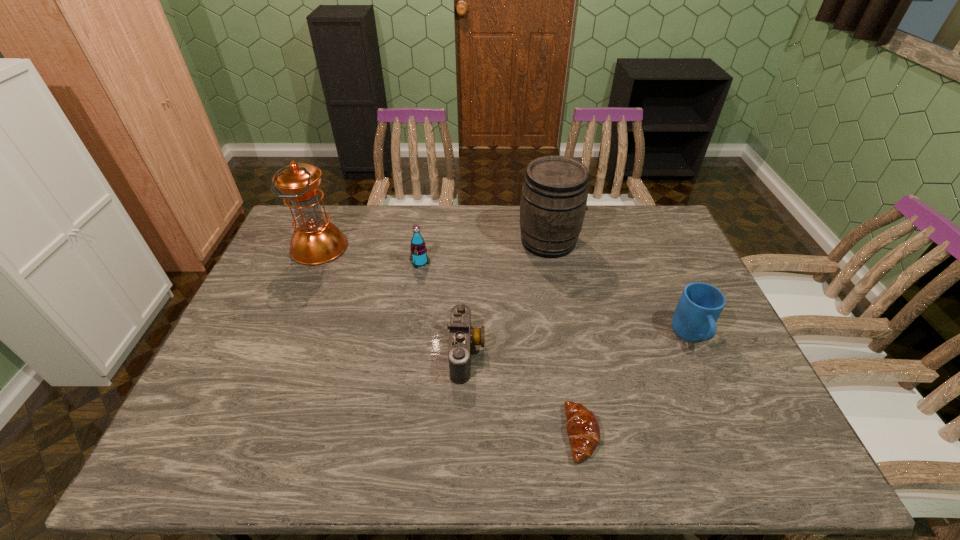
Locate an element on the screen. The height and width of the screenshot is (540, 960). vacant space that is in between the mug and the leftmost object is located at coordinates (505, 292).

The height and width of the screenshot is (540, 960). I want to click on vacant space that is in between the third object from left to right and the second object from left to right, so click(x=444, y=307).

Where is `vacant area between the tallest object and the second shortest object`? The height and width of the screenshot is (540, 960). vacant area between the tallest object and the second shortest object is located at coordinates (393, 300).

I want to click on vacant space in between the nearest object and the mug, so click(636, 385).

You are a GUI agent. You are given a task and a screenshot of the screen. Output one action in this format:
    pyautogui.click(x=<x>, y=<y>)
    Task: Click on the free area in between the fifth tallest object and the second object from left to right
    The image size is (960, 540).
    Given the screenshot: What is the action you would take?
    pyautogui.click(x=444, y=307)

Where is `object that ranks as the third closest to the mug`? This screenshot has width=960, height=540. object that ranks as the third closest to the mug is located at coordinates (462, 336).

Find the location of `object that is the fifth closest to the crescent roll`. object that is the fifth closest to the crescent roll is located at coordinates (316, 241).

Locate an element on the screen. The image size is (960, 540). free location that satisfies the following two spatial constraints: 1. on the side of the rightmost object with the handle; 2. on the lens of the camera is located at coordinates coord(699,353).

Find the location of a particular element. This screenshot has width=960, height=540. free space that satisfies the following two spatial constraints: 1. on the lens of the fifth tallest object; 2. on the left side of the shortest object is located at coordinates (465, 434).

Identify the location of vacant space that satisfies the following two spatial constraints: 1. on the lens of the third object from left to right; 2. on the back side of the nearest object. The width and height of the screenshot is (960, 540). (465, 434).